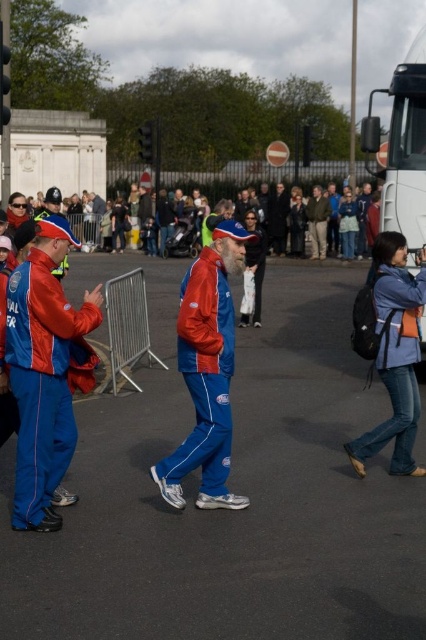
You are a photographer trying to capture both the matte blue tracksuit at center and the dark gray suit at center in a single shot. Which one should you focus on first to ensure the background subject is in frame?

The matte blue tracksuit at center is positioned under the dark gray suit at center, so you should focus on the dark gray suit at center first to ensure it stays in frame while adjusting the shot to include the matte blue tracksuit at center below it.

You are standing at the origin point of the coordinate system. You want to move towards the matte blue tracksuit at center. Which direction should you move in?

The matte blue tracksuit at center is located at coordinates point (207, 372), so you should move towards the right and forward direction to reach it.